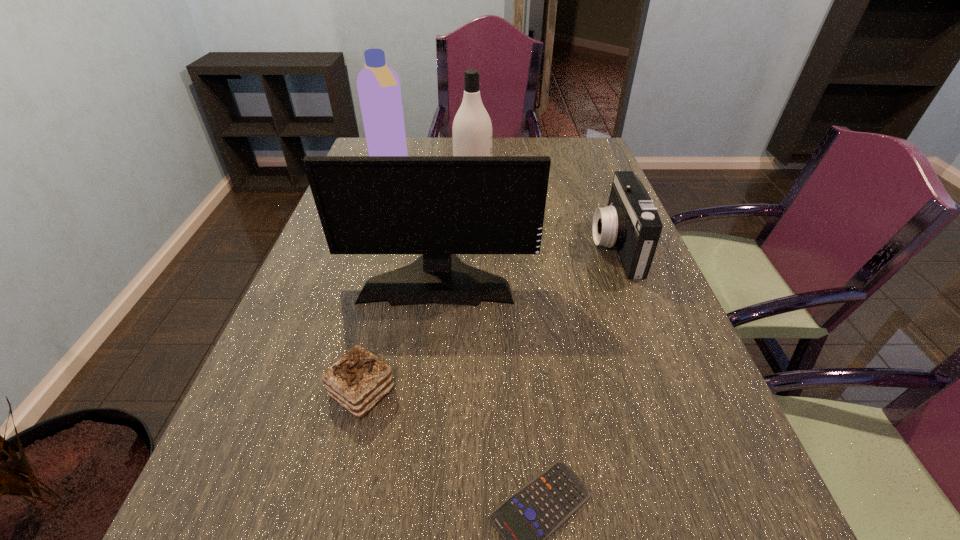
The height and width of the screenshot is (540, 960). I want to click on free region located on the right of the left shampoo, so click(x=438, y=161).

Identify the location of blank space located 0.390m on the screen side of the monitor. This screenshot has height=540, width=960. (416, 476).

At what (x,y) coordinates should I click in order to perform the action: click on vacant space located on the lens of the third shortest object. Please return your answer as a coordinate pair (x, y). Looking at the image, I should click on (466, 247).

Locate an element on the screen. This screenshot has height=540, width=960. vacant space located on the lens of the third shortest object is located at coordinates (511, 247).

Locate an element on the screen. This screenshot has width=960, height=540. vacant space located 0.130m on the lens of the third shortest object is located at coordinates (544, 247).

Find the location of a particular element. The image size is (960, 540). free space located on the left of the chocolate cake is located at coordinates (287, 393).

At what (x,y) coordinates should I click in order to perform the action: click on object situated at the far edge. Please return your answer as a coordinate pair (x, y). The image size is (960, 540). Looking at the image, I should click on (378, 85).

Locate an element on the screen. shampoo at the left edge is located at coordinates (378, 85).

The image size is (960, 540). What are the coordinates of `monitor that is at the left edge` in the screenshot? It's located at (439, 206).

Find the location of a particular element. Image resolution: width=960 pixels, height=540 pixels. chocolate cake present at the left edge is located at coordinates (358, 380).